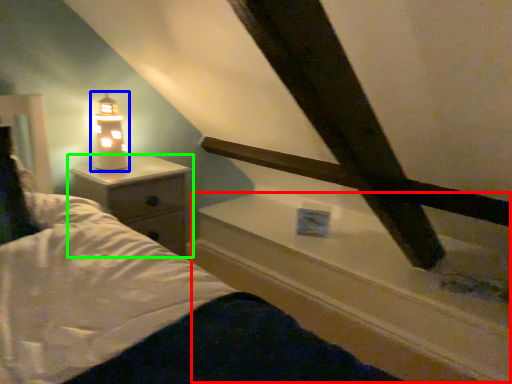
Question: Which is farther away from window sill (highlighted by a red box)? lamp (highlighted by a blue box) or nightstand (highlighted by a green box)?

Choices:
 (A) lamp
 (B) nightstand

Answer: (A)